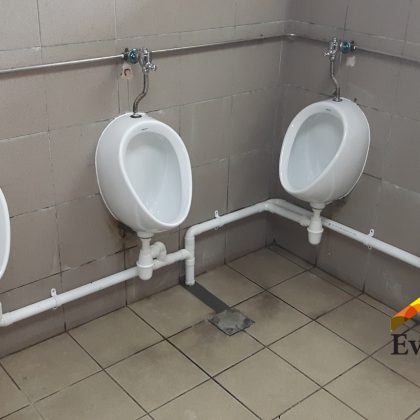
Locate an element on the screen. faucet is located at coordinates (132, 56).